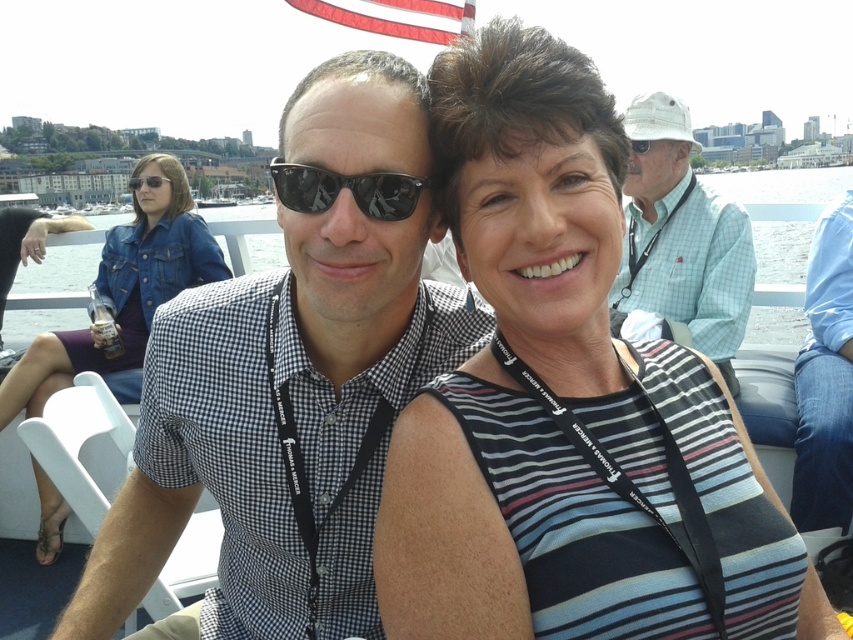
Question: Which point is farther from the camera taking this photo?

Choices:
 (A) (438, 362)
 (B) (704, 449)

Answer: (A)

Question: Estimate the real-world distances between objects in this image. Which object is farther from the striped fabric dress at center?

Choices:
 (A) denim jacket at left
 (B) blue denim jeans at lower right
 (C) white cotton hat at upper right
 (D) black reflective sunglasses at center

Answer: (A)

Question: Does striped fabric dress at center have a greater width compared to black reflective sunglasses at center?

Choices:
 (A) yes
 (B) no

Answer: (A)

Question: Which of these objects is positioned farthest from the denim jacket at left?

Choices:
 (A) black reflective sunglasses at center
 (B) striped fabric dress at center

Answer: (B)

Question: Is striped fabric dress at center thinner than denim jacket at left?

Choices:
 (A) yes
 (B) no

Answer: (B)

Question: Can you confirm if striped fabric dress at center is bigger than blue denim jeans at lower right?

Choices:
 (A) no
 (B) yes

Answer: (B)